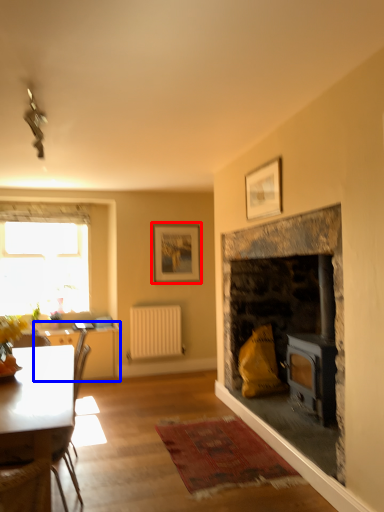
Question: Which of the following is the closest to the observer, picture frame (highlighted by a red box) or table (highlighted by a blue box)?

Choices:
 (A) picture frame
 (B) table

Answer: (B)